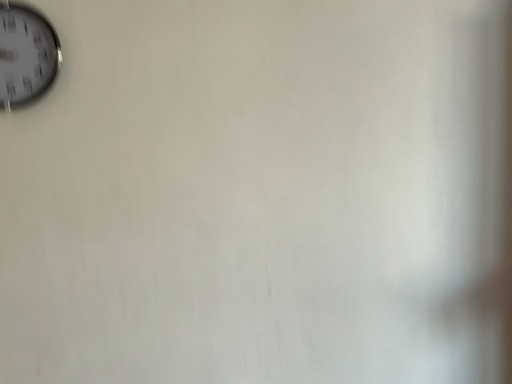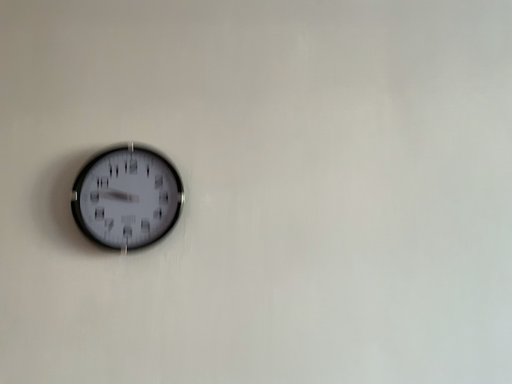
Question: Which way did the camera rotate in the video?

Choices:
 (A) rotated downward
 (B) rotated upward

Answer: (B)